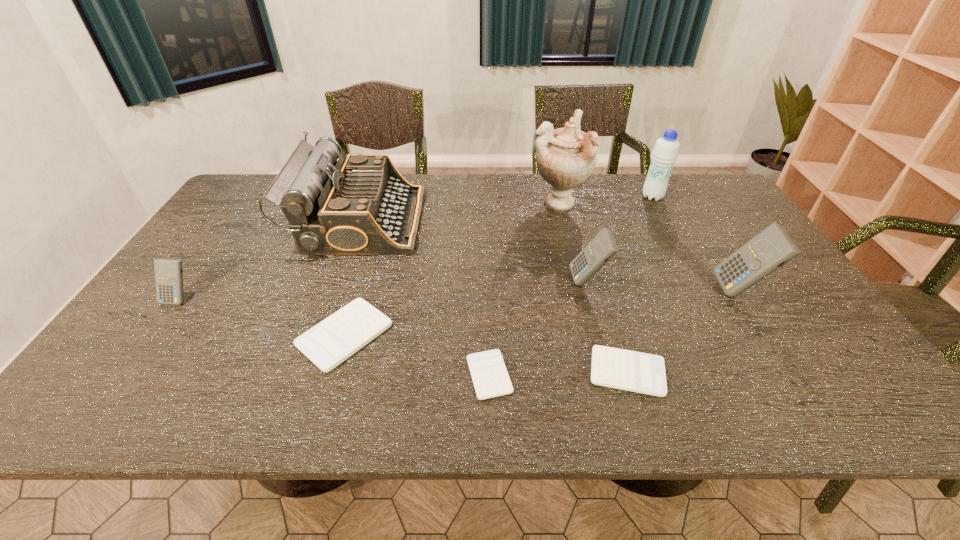
Where is `free location located 0.190m on the front-facing side of the biggest blue calculator`? This screenshot has height=540, width=960. free location located 0.190m on the front-facing side of the biggest blue calculator is located at coordinates tap(644, 291).

Where is `blank space located 0.260m on the front-facing side of the second blue calculator from left to right`? The height and width of the screenshot is (540, 960). blank space located 0.260m on the front-facing side of the second blue calculator from left to right is located at coordinates (473, 281).

At what (x,y) coordinates should I click in order to perform the action: click on vacant space situated 0.080m on the front-facing side of the second blue calculator from left to right. Please return your answer as a coordinate pair (x, y). Image resolution: width=960 pixels, height=540 pixels. Looking at the image, I should click on (540, 281).

Locate an element on the screen. free point located on the front-facing side of the second blue calculator from left to right is located at coordinates (540, 281).

The image size is (960, 540). What are the coordinates of `blank space located on the front-facing side of the leftmost calculator` in the screenshot? It's located at [128, 370].

The image size is (960, 540). I want to click on free spot located 0.180m on the back of the third shortest calculator, so click(x=368, y=256).

Image resolution: width=960 pixels, height=540 pixels. Identify the location of vacant space situated on the right of the rightmost white calculator. (785, 372).

At what (x,y) coordinates should I click in order to perform the action: click on free space located on the right of the shortest object. Please return your answer as a coordinate pair (x, y). Looking at the image, I should click on (660, 375).

Identify the location of urn present at the far edge. (566, 157).

Locate an element on the screen. The image size is (960, 540). water bottle present at the far edge is located at coordinates (x=665, y=152).